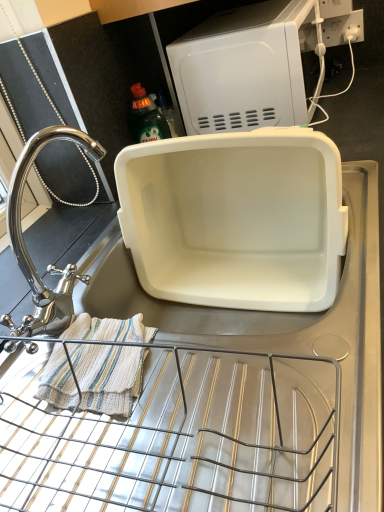
Question: Is the depth of polished chrome faucet at left greater than that of white plastic microwave at upper center, the 1th appliance in the top-to-bottom sequence?

Choices:
 (A) yes
 (B) no

Answer: (B)

Question: Does polished chrome faucet at left have a greater height compared to white plastic microwave at upper center, the 1th appliance in the top-to-bottom sequence?

Choices:
 (A) no
 (B) yes

Answer: (B)

Question: Is polished chrome faucet at left outside white plastic microwave at upper center, placed as the 2th appliance when sorted from bottom to top?

Choices:
 (A) no
 (B) yes

Answer: (B)

Question: From a real-world perspective, is polished chrome faucet at left below white plastic microwave at upper center, the 1th appliance in the top-to-bottom sequence?

Choices:
 (A) yes
 (B) no

Answer: (B)

Question: Is the depth of polished chrome faucet at left less than that of white plastic microwave at upper center, the 1th appliance in the top-to-bottom sequence?

Choices:
 (A) yes
 (B) no

Answer: (A)

Question: Considering the relative sizes of polished chrome faucet at left and white plastic microwave at upper center, the 1th appliance in the top-to-bottom sequence, in the image provided, is polished chrome faucet at left shorter than white plastic microwave at upper center, the 1th appliance in the top-to-bottom sequence,?

Choices:
 (A) yes
 (B) no

Answer: (B)

Question: From a real-world perspective, is white plastic electric outlet at upper right positioned under white plastic microwave at upper center, placed as the 2th appliance when sorted from bottom to top, based on gravity?

Choices:
 (A) no
 (B) yes

Answer: (B)

Question: Does white plastic electric outlet at upper right have a greater height compared to white plastic microwave at upper center, the 1th appliance in the top-to-bottom sequence?

Choices:
 (A) no
 (B) yes

Answer: (A)

Question: Considering the relative positions of white plastic electric outlet at upper right and white plastic microwave at upper center, the 1th appliance in the top-to-bottom sequence, in the image provided, is white plastic electric outlet at upper right to the right of white plastic microwave at upper center, the 1th appliance in the top-to-bottom sequence, from the viewer's perspective?

Choices:
 (A) no
 (B) yes

Answer: (B)

Question: From the image's perspective, does white plastic electric outlet at upper right appear lower than white plastic microwave at upper center, the 1th appliance in the top-to-bottom sequence?

Choices:
 (A) yes
 (B) no

Answer: (B)

Question: From the image's perspective, is white plastic electric outlet at upper right on top of white plastic microwave at upper center, the 1th appliance in the top-to-bottom sequence?

Choices:
 (A) yes
 (B) no

Answer: (A)

Question: Is white plastic electric outlet at upper right located outside white plastic microwave at upper center, the 1th appliance in the top-to-bottom sequence?

Choices:
 (A) yes
 (B) no

Answer: (A)

Question: Is white plastic electric outlet at upper right at the left side of white plastic container at center, which is the second appliance from top to bottom?

Choices:
 (A) no
 (B) yes

Answer: (A)